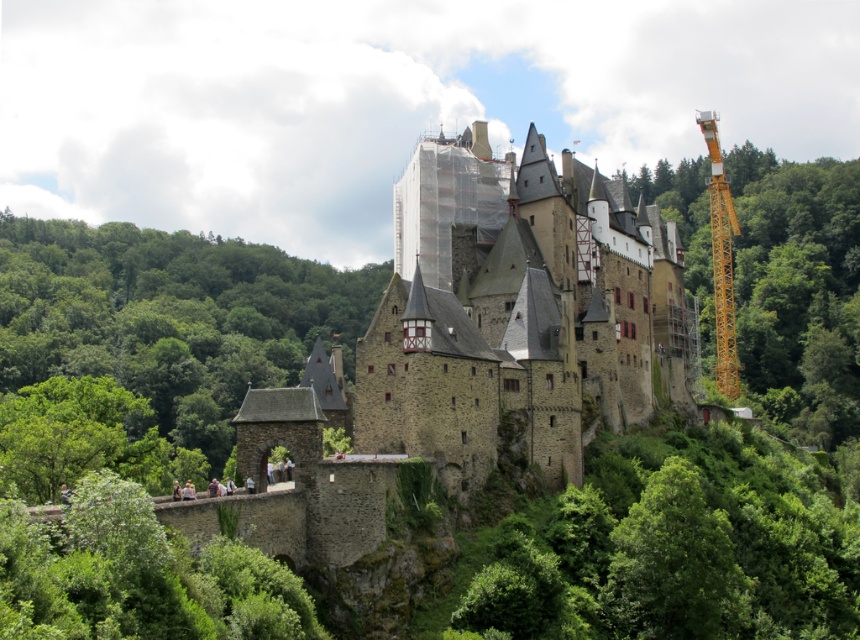
Question: Which point is closer to the camera?

Choices:
 (A) green leafy tree at right
 (B) green leafy tree at center
 (C) yellow metallic crane at right
 (D) stone castle at center

Answer: (D)

Question: Which of the following is the closest to the observer?

Choices:
 (A) (129, 326)
 (B) (830, 440)
 (C) (578, 608)
 (D) (447, 296)

Answer: (C)

Question: Does green leafy tree at lower left have a larger size compared to green leafy tree at center?

Choices:
 (A) no
 (B) yes

Answer: (B)

Question: Can you confirm if stone castle at center is thinner than green leafy tree at lower left?

Choices:
 (A) yes
 (B) no

Answer: (A)

Question: Based on their relative distances, which object is nearer to the yellow metallic crane at right?

Choices:
 (A) green leafy tree at center
 (B) stone castle at center
 (C) green leafy tree at right
 (D) green leafy tree at lower left

Answer: (C)

Question: Does green leafy tree at right have a larger size compared to yellow metallic crane at right?

Choices:
 (A) yes
 (B) no

Answer: (A)